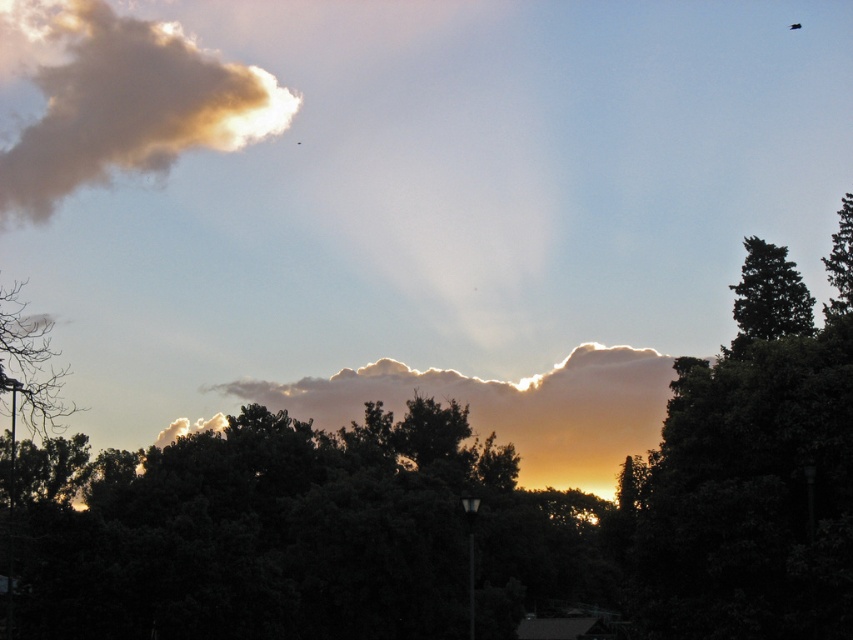
You are standing in the middle of a forest and see the green leafy tree at center and the green textured tree at right. Which tree is closer to your left side?

The green leafy tree at center is positioned on the left side of the green textured tree at right, so it is closer to your left side.

You are standing in the middle of this outdoor scene and want to take a photo. There are two points in the sky that you want to capture in your shot. The first point is at coordinate point(767, 442) and the second is at point(799, 305). Which point will appear larger in your photo?

Point(767, 442) is closer to the camera than point(799, 305), so it will appear larger in the photo.